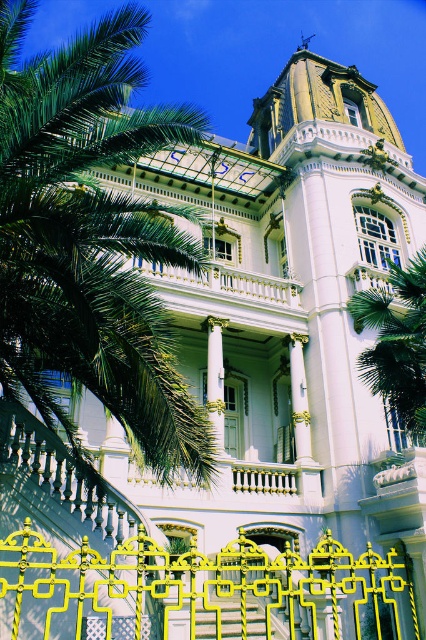
You are standing in front of the grand building and want to enter through the entrance. There is a green leafy palm tree at center and yellow metallic stairs at center in your way. Which object should you move around to reach the entrance?

→ You should move around the green leafy palm tree at center because it is closer to you than the yellow metallic stairs at center, so you need to navigate around it first to reach the stairs leading to the entrance.

You are standing in front of the grand building and notice a green leafy palm tree at center and a white marble column at center. Which object is positioned to the right side from your perspective?

The green leafy palm tree at center is positioned to the right of the white marble column at center.

You are standing at the entrance of the grand ornate building and see a point marked at coordinates point (91, 241). What object is this point located on?

The point (91, 241) is located on the green leafy palm tree at left.